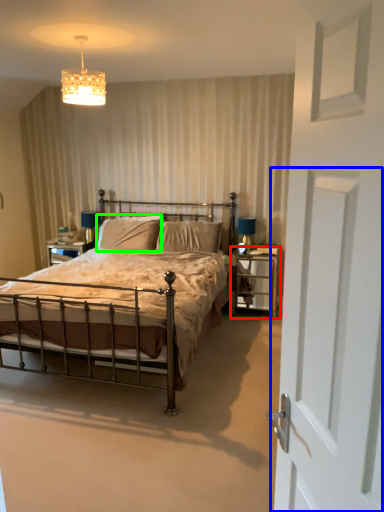
Question: Based on their relative distances, which object is farther from nightstand (highlighted by a red box)? Choose from screen door (highlighted by a blue box) and pillow (highlighted by a green box).

Choices:
 (A) screen door
 (B) pillow

Answer: (A)